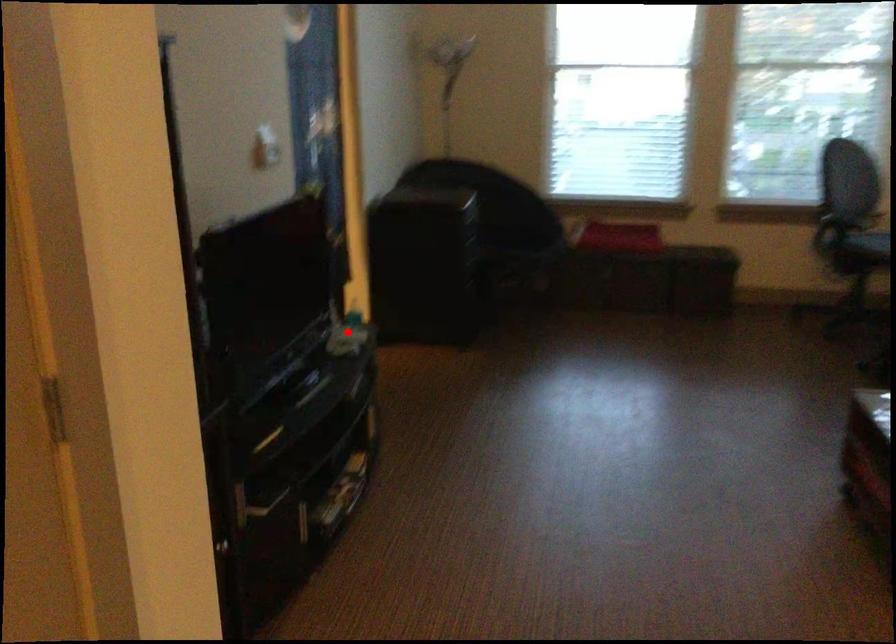
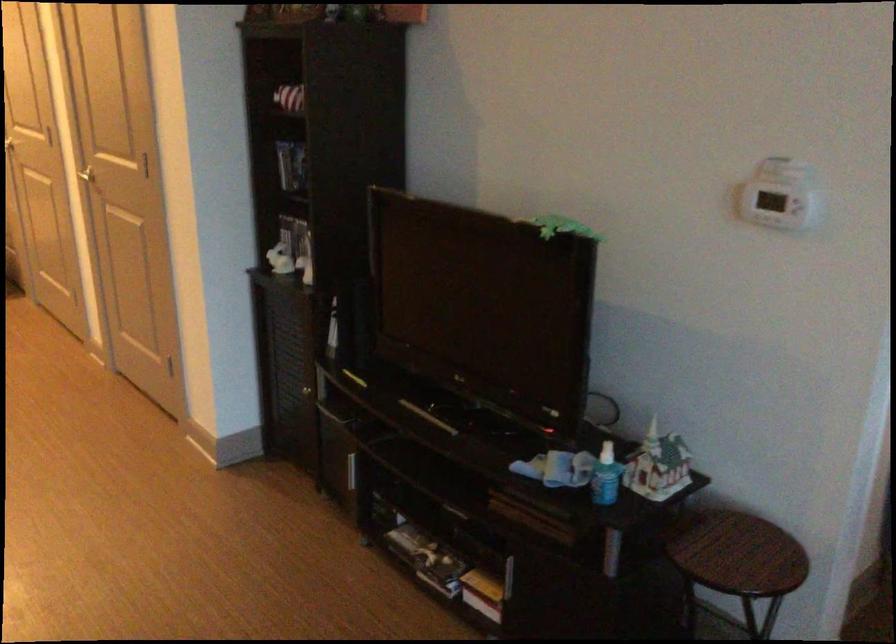
Where in the second image is the point corresponding to the highlighted location from the first image?

(733, 547)